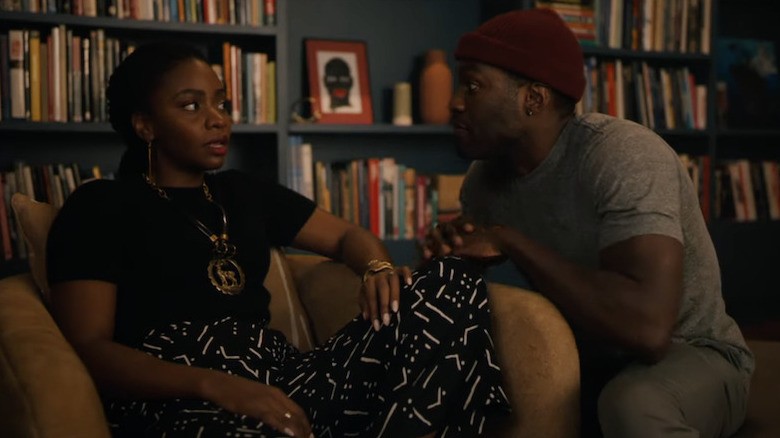
Locate an element on the screen. This screenshot has height=438, width=780. cushion is located at coordinates (530, 353).